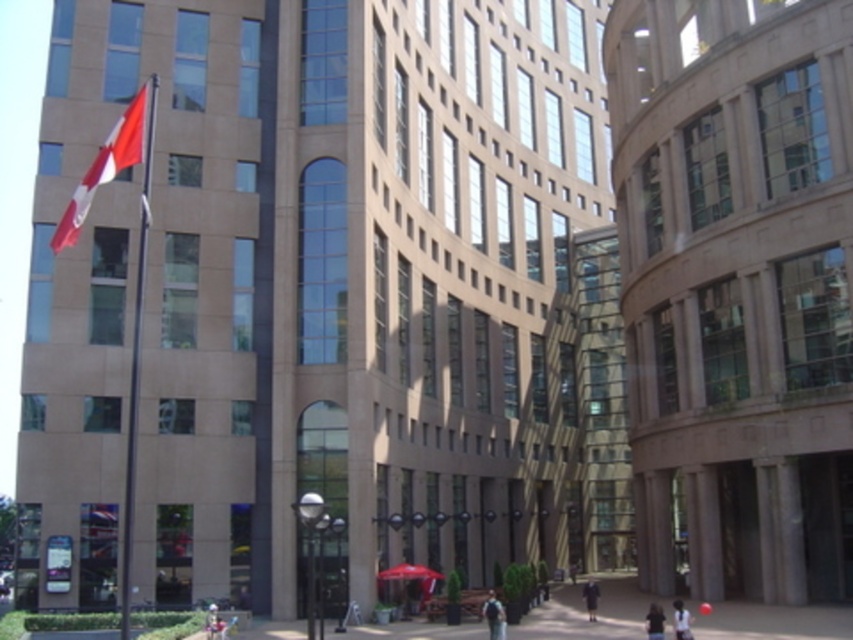
What do you see at coordinates (654, 621) in the screenshot?
I see `blurred fabric person at lower right` at bounding box center [654, 621].

Find the location of a particular element. This screenshot has height=640, width=853. blurred fabric person at lower right is located at coordinates (654, 621).

Where is `blurred fabric person at lower right`? Image resolution: width=853 pixels, height=640 pixels. blurred fabric person at lower right is located at coordinates (654, 621).

Which is more to the left, red fabric flag at upper left or dark blue backpack at center?

red fabric flag at upper left

Between point (77, 221) and point (496, 627), which one is positioned behind?

The point (496, 627) is more distant.

Who is more distant from viewer, (125, 147) or (498, 604)?

Positioned behind is point (498, 604).

Identify the location of red fabric flag at upper left. This screenshot has width=853, height=640. (105, 168).

Can you confirm if red fabric flag at upper left is smaller than white fabric shirt at lower right?

Actually, red fabric flag at upper left might be larger than white fabric shirt at lower right.

Where is `red fabric flag at upper left`? This screenshot has width=853, height=640. red fabric flag at upper left is located at coordinates (105, 168).